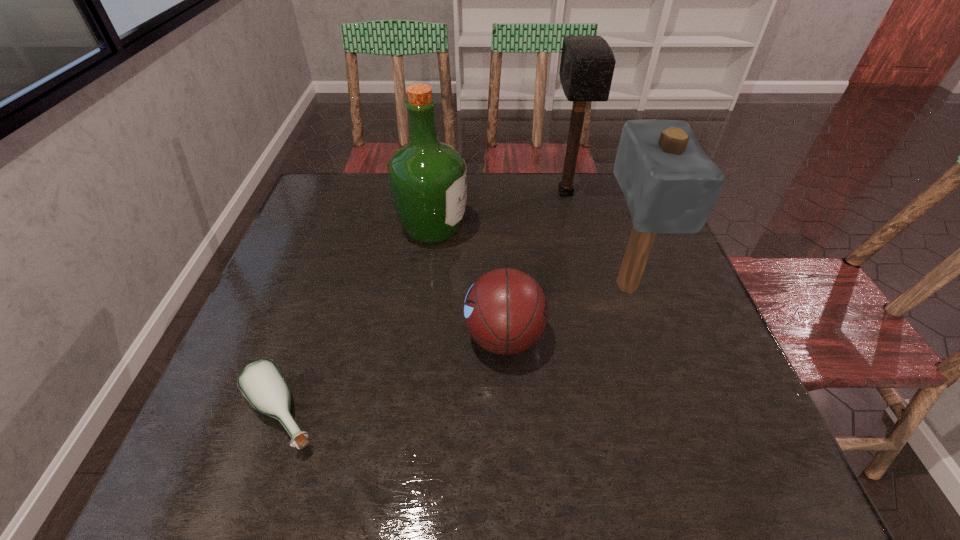
The width and height of the screenshot is (960, 540). I want to click on vacant space at the right edge of the desktop, so click(x=733, y=369).

In order to click on vacant space at the far left corner of the desktop in this screenshot , I will do `click(347, 217)`.

This screenshot has width=960, height=540. What are the coordinates of `free point between the farther mallet and the nearer mallet` in the screenshot? It's located at (596, 239).

Where is `free space that is in between the basketball and the liquor`? This screenshot has height=540, width=960. free space that is in between the basketball and the liquor is located at coordinates (468, 283).

At what (x,y) coordinates should I click in order to perform the action: click on free point between the nearer mallet and the farther mallet. Please return your answer as a coordinate pair (x, y). The width and height of the screenshot is (960, 540). Looking at the image, I should click on (596, 239).

Image resolution: width=960 pixels, height=540 pixels. Identify the location of free spot between the bottle and the second shortest object. (393, 375).

Image resolution: width=960 pixels, height=540 pixels. Find the location of `free spot between the liquor and the nearer mallet`. free spot between the liquor and the nearer mallet is located at coordinates (530, 257).

Where is `vacant space that's between the liquor and the fourth tallest object`? The image size is (960, 540). vacant space that's between the liquor and the fourth tallest object is located at coordinates (468, 283).

Find the location of a particular element. free space between the second shortest object and the liquor is located at coordinates (468, 283).

I want to click on vacant area between the liquor and the bottle, so click(x=357, y=321).